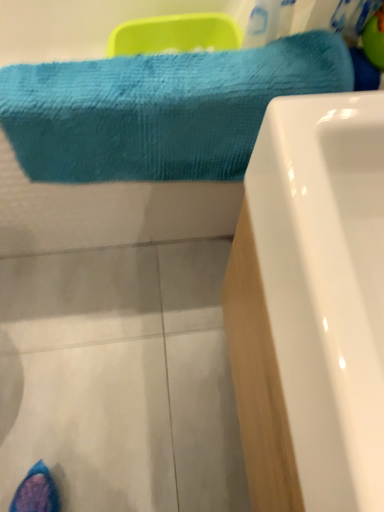
This screenshot has width=384, height=512. I want to click on white glossy bathtub at lower right, so click(x=311, y=306).

What do you see at coordinates (311, 306) in the screenshot?
I see `white glossy bathtub at lower right` at bounding box center [311, 306].

This screenshot has width=384, height=512. Describe the element at coordinates (160, 109) in the screenshot. I see `turquoise textured towel at upper left` at that location.

The width and height of the screenshot is (384, 512). I want to click on turquoise textured towel at upper left, so click(160, 109).

What are the coordinates of `white glossy bathtub at lower right` in the screenshot? It's located at (311, 306).

In the image, is turquoise textured towel at upper left on the left side or the right side of white glossy bathtub at lower right?

Clearly, turquoise textured towel at upper left is on the left of white glossy bathtub at lower right in the image.

In the image, is turquoise textured towel at upper left positioned in front of or behind white glossy bathtub at lower right?

turquoise textured towel at upper left is behind white glossy bathtub at lower right.

Is point (74, 75) closer or farther from the camera than point (310, 269)?

Clearly, point (74, 75) is more distant from the camera than point (310, 269).

From the image's perspective, would you say turquoise textured towel at upper left is positioned over white glossy bathtub at lower right?

Yes, from the image's perspective, turquoise textured towel at upper left is over white glossy bathtub at lower right.

From a real-world perspective, who is located lower, turquoise textured towel at upper left or white glossy bathtub at lower right?

white glossy bathtub at lower right, from a real-world perspective.

Which of these two, turquoise textured towel at upper left or white glossy bathtub at lower right, is wider?

Wider between the two is turquoise textured towel at upper left.

Which of these two, turquoise textured towel at upper left or white glossy bathtub at lower right, stands taller?

white glossy bathtub at lower right is taller.

Based on their sizes in the image, would you say turquoise textured towel at upper left is bigger or smaller than white glossy bathtub at lower right?

Considering their sizes, turquoise textured towel at upper left takes up less space than white glossy bathtub at lower right.

Would you say turquoise textured towel at upper left is outside white glossy bathtub at lower right?

turquoise textured towel at upper left is positioned outside white glossy bathtub at lower right.

Is turquoise textured towel at upper left next to white glossy bathtub at lower right and touching it?

No, turquoise textured towel at upper left is not beside white glossy bathtub at lower right.

Is turquoise textured towel at upper left facing away from white glossy bathtub at lower right?

That's not correct — turquoise textured towel at upper left is not looking away from white glossy bathtub at lower right.

Image resolution: width=384 pixels, height=512 pixels. Identify the location of towel behind the white glossy bathtub at lower right. (160, 109).

Which object is positioned more to the left, white glossy bathtub at lower right or turquoise textured towel at upper left?

turquoise textured towel at upper left is more to the left.

Which object is further away from the camera taking this photo, white glossy bathtub at lower right or turquoise textured towel at upper left?

turquoise textured towel at upper left is further away from the camera.

Does point (326, 150) come in front of point (171, 89)?

Yes.

From the image's perspective, is white glossy bathtub at lower right above or below turquoise textured towel at upper left?

Clearly, from the image's perspective, white glossy bathtub at lower right is below turquoise textured towel at upper left.

From a real-world perspective, which is physically above, white glossy bathtub at lower right or turquoise textured towel at upper left?

turquoise textured towel at upper left, from a real-world perspective.

Which object is wider, white glossy bathtub at lower right or turquoise textured towel at upper left?

turquoise textured towel at upper left is wider.

Considering the relative sizes of white glossy bathtub at lower right and turquoise textured towel at upper left in the image provided, is white glossy bathtub at lower right taller than turquoise textured towel at upper left?

Yes, white glossy bathtub at lower right is taller than turquoise textured towel at upper left.

Between white glossy bathtub at lower right and turquoise textured towel at upper left, which one has smaller size?

With smaller size is turquoise textured towel at upper left.

Would you say white glossy bathtub at lower right is outside turquoise textured towel at upper left?

Indeed, white glossy bathtub at lower right is completely outside turquoise textured towel at upper left.

Is white glossy bathtub at lower right not close to turquoise textured towel at upper left?

white glossy bathtub at lower right is near turquoise textured towel at upper left, not far away.

Does white glossy bathtub at lower right turn towards turquoise textured towel at upper left?

No, white glossy bathtub at lower right is not aimed at turquoise textured towel at upper left.

How different are the orientations of white glossy bathtub at lower right and turquoise textured towel at upper left in degrees?

There is a 89.9-degree angle between the facing directions of white glossy bathtub at lower right and turquoise textured towel at upper left.

What are the coordinates of `towel lying on the left of white glossy bathtub at lower right` in the screenshot? It's located at (160, 109).

You are a GUI agent. You are given a task and a screenshot of the screen. Output one action in this format:
    pyautogui.click(x=<x>, y=<y>)
    Task: Click on the towel that appears behind the white glossy bathtub at lower right
    Image resolution: width=384 pixels, height=512 pixels.
    Given the screenshot: What is the action you would take?
    pyautogui.click(x=160, y=109)

In the image, there is a turquoise textured towel at upper left. At what (x,y) coordinates should I click in order to perform the action: click on bathtub below it (from a real-world perspective). Please return your answer as a coordinate pair (x, y). Looking at the image, I should click on (311, 306).